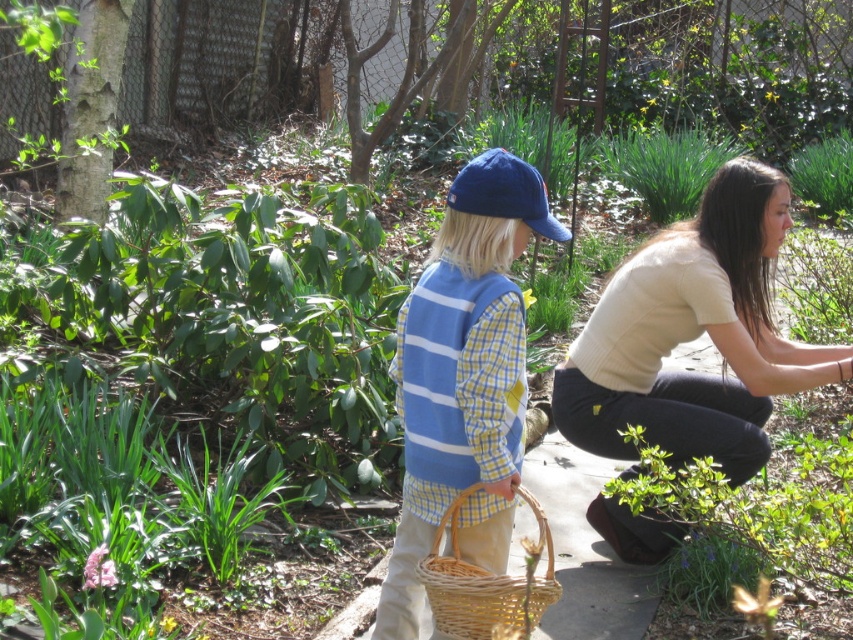
Does light beige sweater at lower right appear under woven natural basket at lower center?

No, light beige sweater at lower right is not below woven natural basket at lower center.

Between light beige sweater at lower right and woven natural basket at lower center, which one has less height?

woven natural basket at lower center

Which is in front, point (641, 557) or point (451, 529)?

Point (451, 529) is more forward.

You are a GUI agent. You are given a task and a screenshot of the screen. Output one action in this format:
    pyautogui.click(x=<x>, y=<y>)
    Task: Click on the light beige sweater at lower right
    
    Given the screenshot: What is the action you would take?
    pyautogui.click(x=694, y=336)

Does light beige sweater at lower right appear on the right side of blue cotton cap at center?

Yes, light beige sweater at lower right is to the right of blue cotton cap at center.

Which is behind, point (654, 397) or point (444, 353)?

Point (654, 397)

Image resolution: width=853 pixels, height=640 pixels. What do you see at coordinates (694, 336) in the screenshot?
I see `light beige sweater at lower right` at bounding box center [694, 336].

Identify the location of light beige sweater at lower right. (694, 336).

Who is lower down, blue cotton cap at center or woven natural basket at lower center?

woven natural basket at lower center is below.

Between blue cotton cap at center and woven natural basket at lower center, which one has more height?

Standing taller between the two is blue cotton cap at center.

This screenshot has height=640, width=853. Identify the location of blue cotton cap at center. (463, 378).